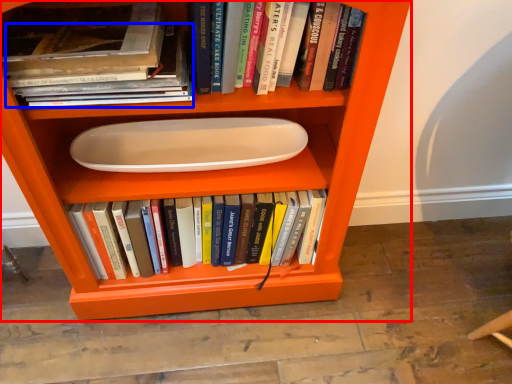
Question: Among these objects, which one is nearest to the camera, shelf (highlighted by a red box) or book (highlighted by a blue box)?

Choices:
 (A) shelf
 (B) book

Answer: (A)